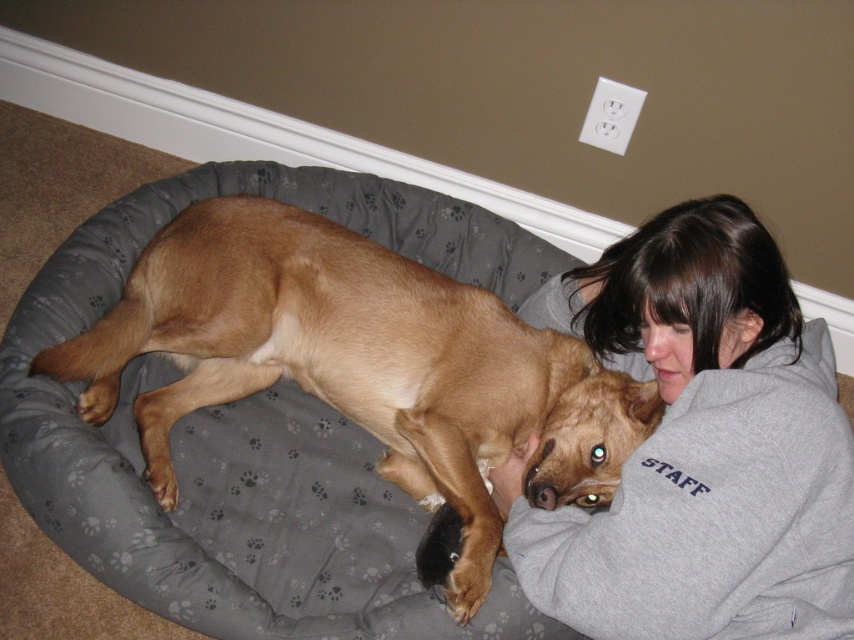
Who is positioned more to the left, brown smooth dog at center or gray fleece sweatshirt at upper right?

brown smooth dog at center is more to the left.

Based on the photo, which is more to the right, brown smooth dog at center or gray fleece sweatshirt at upper right?

gray fleece sweatshirt at upper right

This screenshot has height=640, width=854. I want to click on brown smooth dog at center, so click(361, 365).

The image size is (854, 640). I want to click on brown smooth dog at center, so click(x=361, y=365).